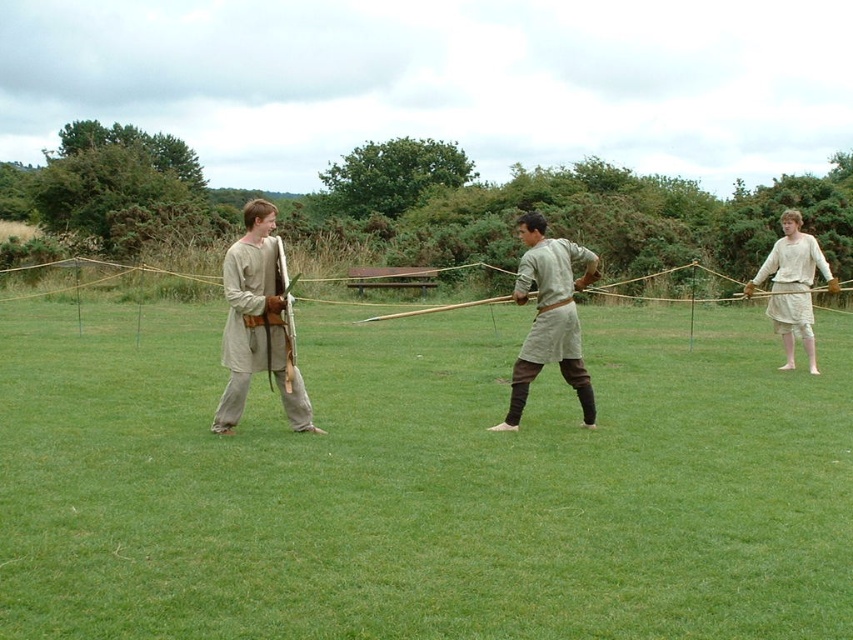
Between light beige fabric shirt at left and light beige fabric shirt at center, which one appears on the right side from the viewer's perspective?

From the viewer's perspective, light beige fabric shirt at center appears more on the right side.

Identify the location of light beige fabric shirt at left. (257, 324).

This screenshot has height=640, width=853. In order to click on light beige fabric shirt at left in this screenshot , I will do `click(257, 324)`.

Which is behind, point (846, 413) or point (242, 390)?

Positioned behind is point (846, 413).

How much distance is there between green grass at center and light beige fabric shirt at left?

green grass at center and light beige fabric shirt at left are 2.96 meters apart from each other.

Which is behind, point (468, 616) or point (254, 216)?

Point (254, 216)

The height and width of the screenshot is (640, 853). Identify the location of green grass at center. (x=422, y=483).

Where is `light beige fabric shirt at center`? The height and width of the screenshot is (640, 853). light beige fabric shirt at center is located at coordinates (549, 316).

Between point (572, 356) and point (792, 266), which one is positioned in front?

Point (572, 356) is more forward.

In order to click on light beige fabric shirt at center in this screenshot , I will do `click(549, 316)`.